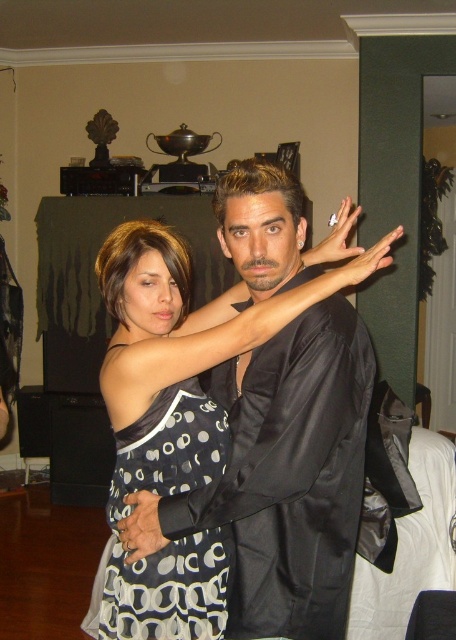
Who is lower down, black satin dress at center or black dotted fabric dress at center?

Positioned lower is black dotted fabric dress at center.

Which is more to the left, black satin dress at center or black dotted fabric dress at center?

black dotted fabric dress at center is more to the left.

Is point (135, 461) closer to camera compared to point (109, 593)?

That is True.

The width and height of the screenshot is (456, 640). In order to click on black satin dress at center in this screenshot , I will do `click(171, 333)`.